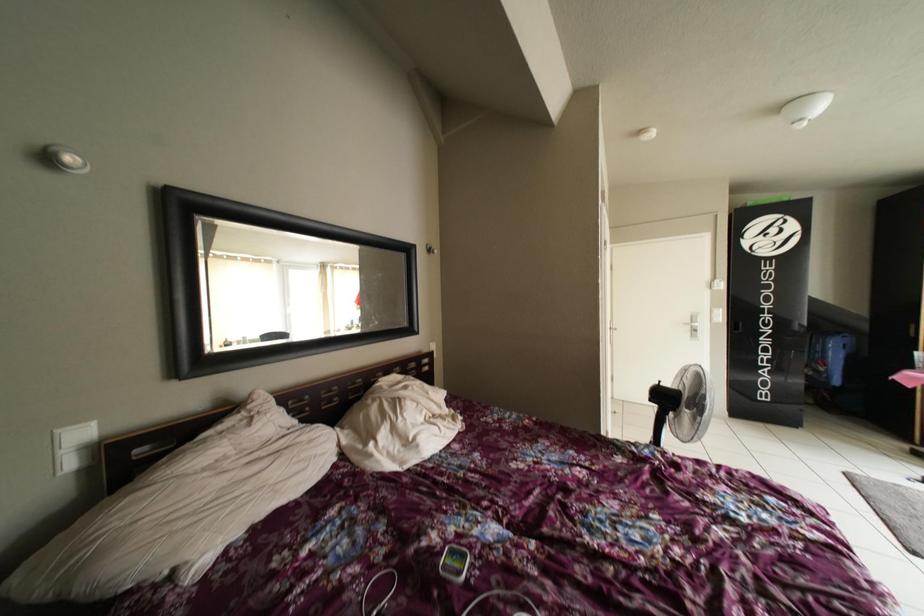
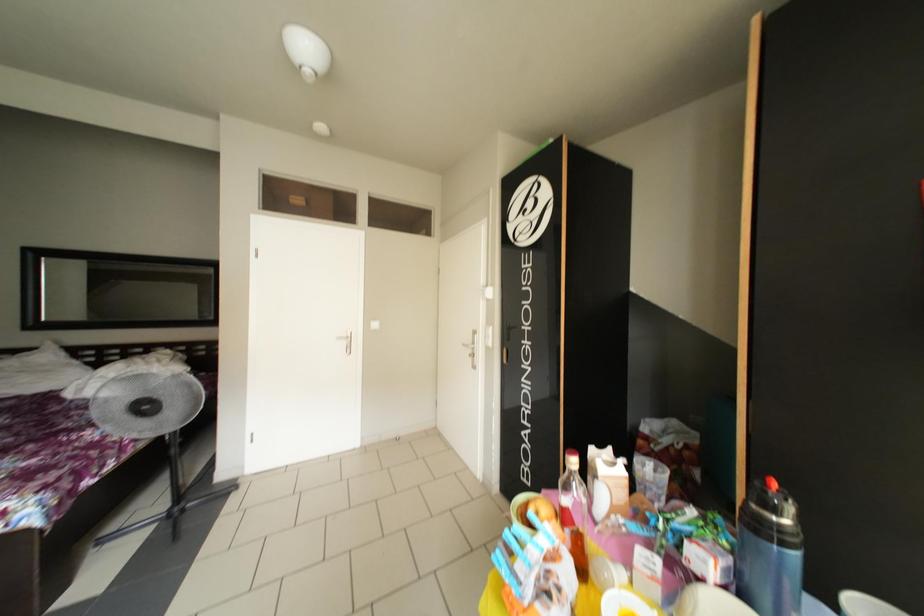
Question: Which direction would the cameraman need to move to produce the second image? Reply with the corresponding letter.

Choices:
 (A) Left
 (B) Right
 (C) Forward
 (D) Backward

Answer: (B)